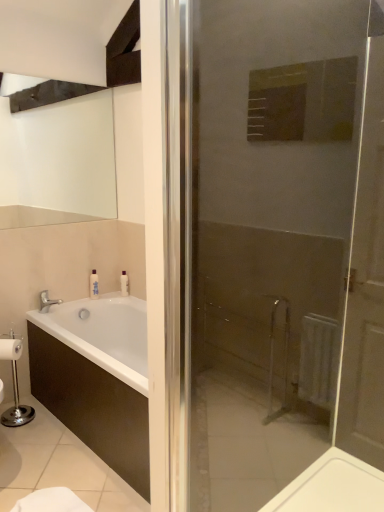
Question: Could silver metallic faucet at lower left be considered to be inside white wooden door at center?

Choices:
 (A) no
 (B) yes

Answer: (A)

Question: Is white wooden door at center shorter than silver metallic faucet at lower left?

Choices:
 (A) yes
 (B) no

Answer: (B)

Question: Is white wooden door at center thinner than silver metallic faucet at lower left?

Choices:
 (A) yes
 (B) no

Answer: (A)

Question: Considering the relative sizes of white wooden door at center and silver metallic faucet at lower left in the image provided, is white wooden door at center bigger than silver metallic faucet at lower left?

Choices:
 (A) yes
 (B) no

Answer: (A)

Question: Does white wooden door at center appear on the right side of silver metallic faucet at lower left?

Choices:
 (A) no
 (B) yes

Answer: (B)

Question: Considering the relative sizes of white wooden door at center and silver metallic faucet at lower left in the image provided, is white wooden door at center smaller than silver metallic faucet at lower left?

Choices:
 (A) yes
 (B) no

Answer: (B)

Question: Is white glossy bottle at upper left next to white wooden door at center?

Choices:
 (A) no
 (B) yes

Answer: (A)

Question: From a real-world perspective, is white glossy bottle at upper left on white wooden door at center?

Choices:
 (A) yes
 (B) no

Answer: (B)

Question: Is white glossy bottle at upper left to the right of white wooden door at center from the viewer's perspective?

Choices:
 (A) yes
 (B) no

Answer: (B)

Question: Considering the relative positions of white glossy bottle at upper left and white wooden door at center in the image provided, is white glossy bottle at upper left in front of white wooden door at center?

Choices:
 (A) no
 (B) yes

Answer: (A)

Question: Can we say white glossy bottle at upper left lies outside white wooden door at center?

Choices:
 (A) yes
 (B) no

Answer: (A)

Question: Is white glossy bottle at upper left turned away from white wooden door at center?

Choices:
 (A) no
 (B) yes

Answer: (A)

Question: Is white wooden door at center taller than white glossy bottle at upper left?

Choices:
 (A) no
 (B) yes

Answer: (B)